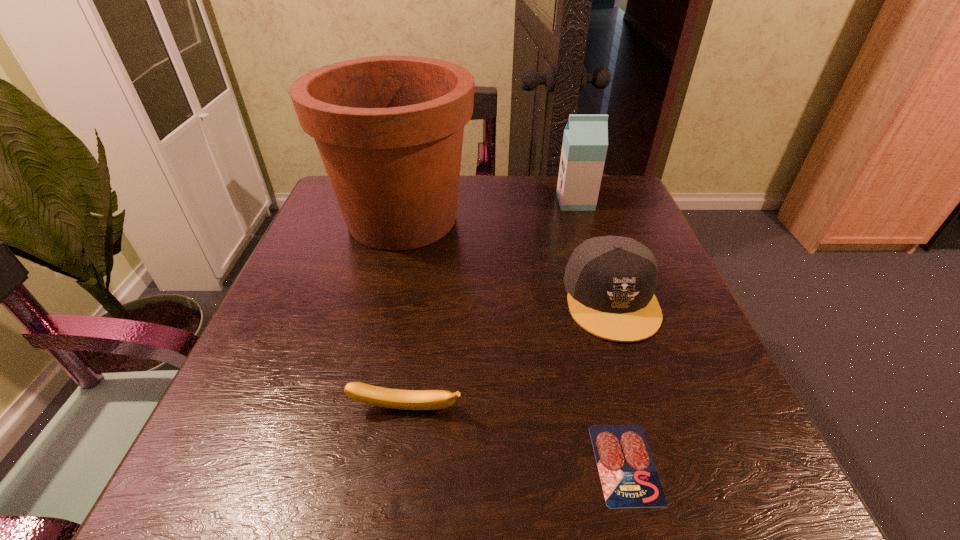
Locate an element on the screen. The width and height of the screenshot is (960, 540). the tallest object is located at coordinates (389, 129).

The width and height of the screenshot is (960, 540). I want to click on the second tallest object, so click(585, 141).

Identify the location of cap. The width and height of the screenshot is (960, 540). (610, 280).

Identify the location of the fourth tallest object. The height and width of the screenshot is (540, 960). (377, 396).

Find the location of a particular element. the second nearest object is located at coordinates (377, 396).

Locate an element on the screen. This screenshot has width=960, height=540. salami is located at coordinates (629, 479).

Where is `the shortest object`? the shortest object is located at coordinates (629, 479).

Image resolution: width=960 pixels, height=540 pixels. I want to click on free space located 0.160m on the front of the tallest object, so click(378, 322).

Where is `vacant space located 0.210m on the front of the fourth shortest object`? vacant space located 0.210m on the front of the fourth shortest object is located at coordinates tap(595, 266).

What are the coordinates of `blank space located 0.130m on the front-facing side of the cap` in the screenshot? It's located at (x=647, y=410).